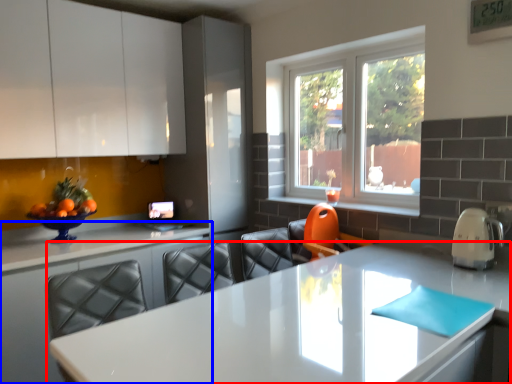
Question: Which point is closer to the camera, countertop (highlighted by a red box) or countertop (highlighted by a blue box)?

Choices:
 (A) countertop
 (B) countertop

Answer: (A)